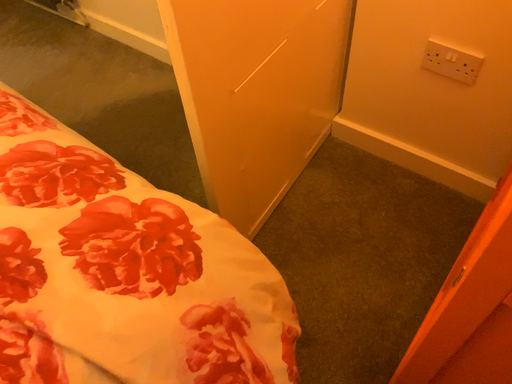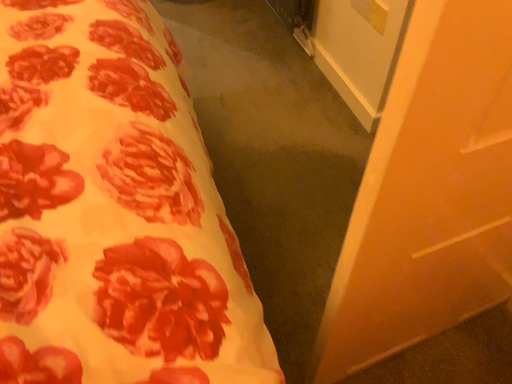
Question: How did the camera likely rotate when shooting the video?

Choices:
 (A) rotated right
 (B) rotated left

Answer: (B)